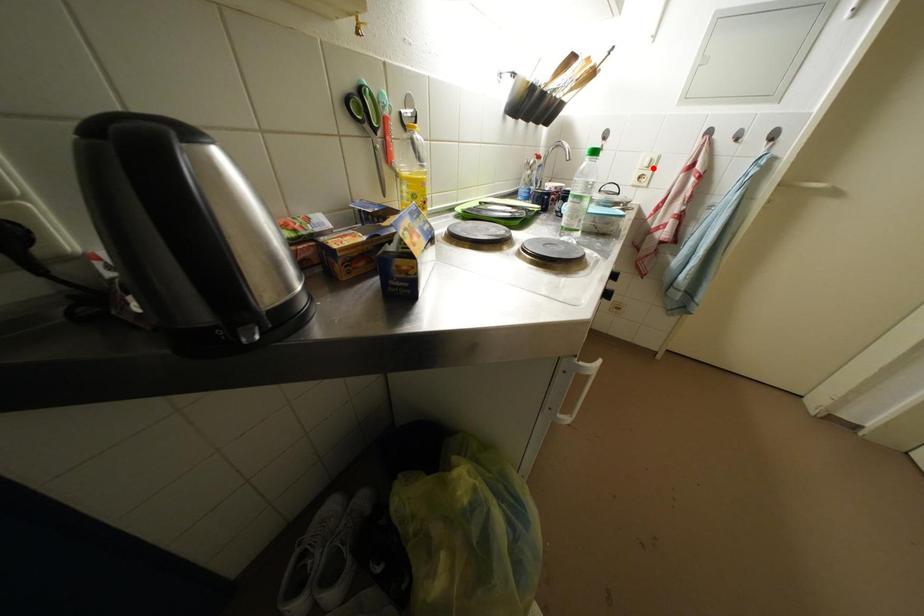
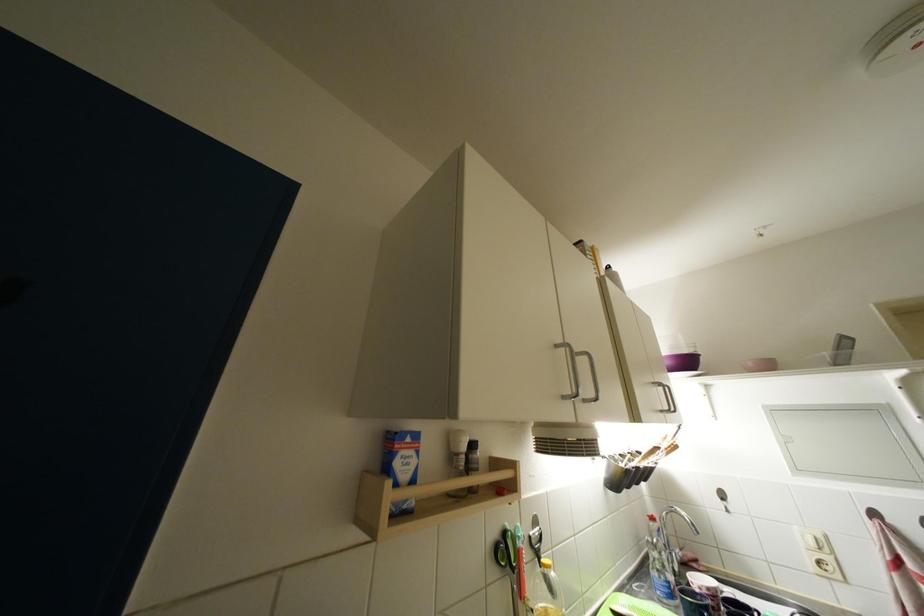
Where in the second image is the point corresponding to the highlighted location from the first image?

(820, 548)